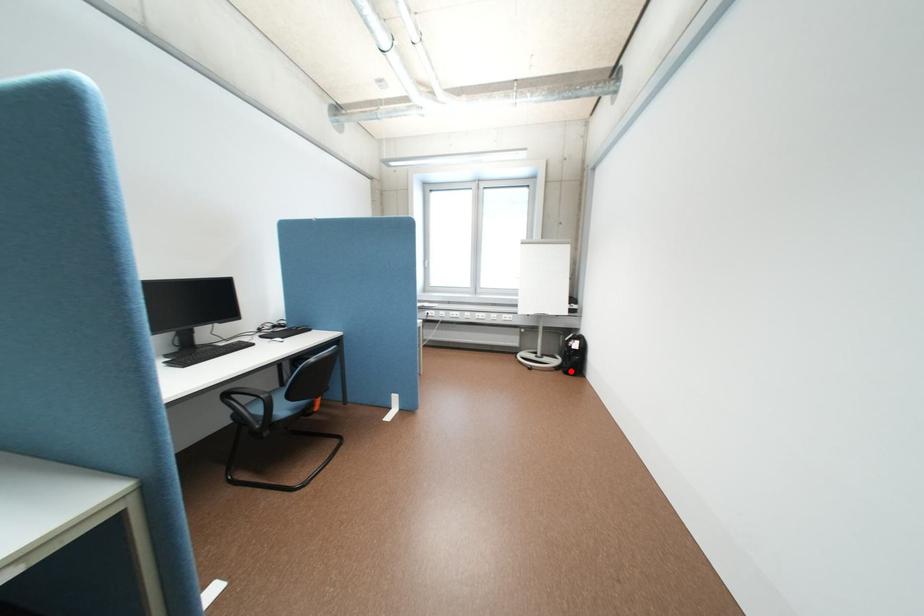
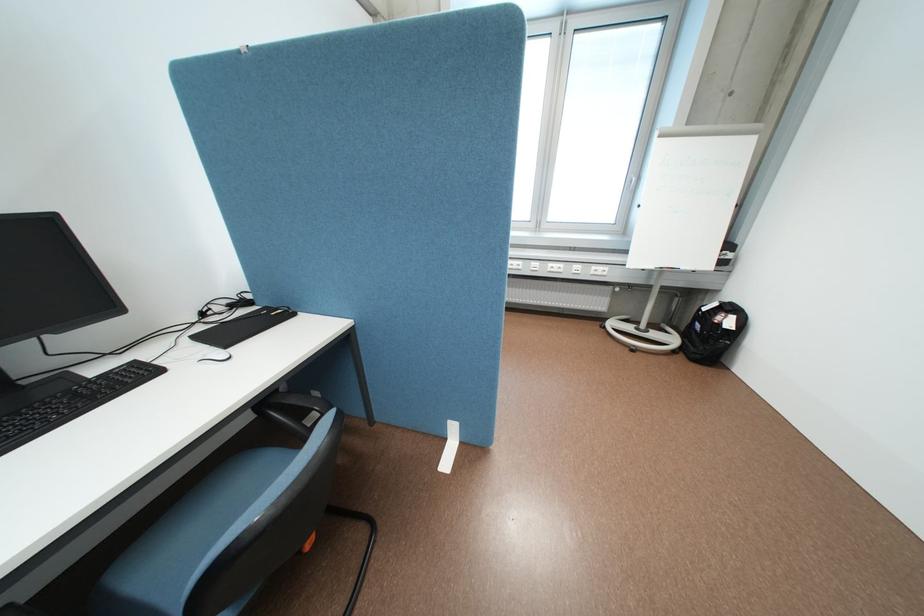
Question: I am providing you with two images of the same scene from different viewpoints. Image1 has a red point marked. In image2, the corresponding 3D location appears at what relative position? Reply with the corresponding letter.

Choices:
 (A) Closer
 (B) Farther

Answer: (A)